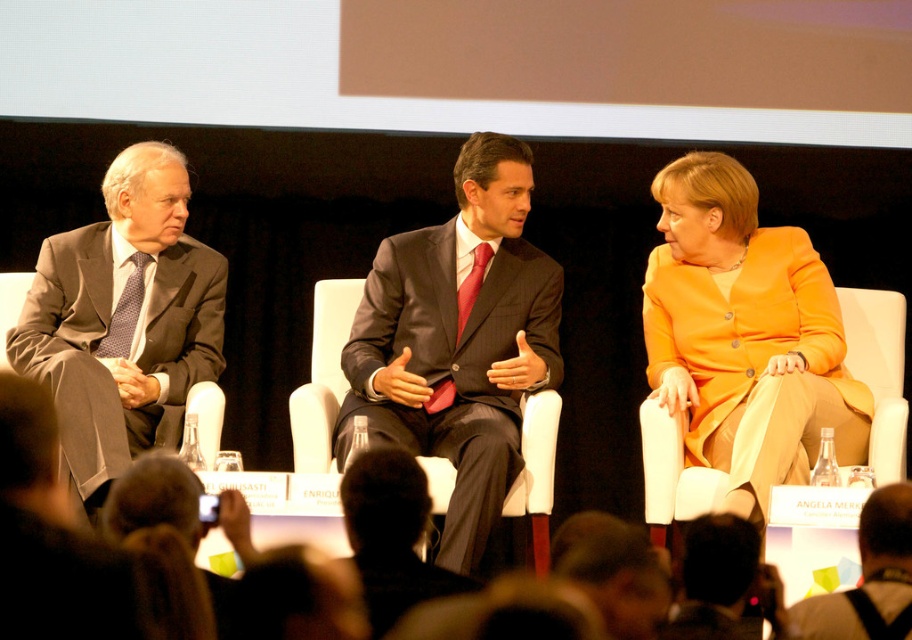
Can you confirm if matte black suit at center is wider than black fabric head at lower center?

Yes, matte black suit at center is wider than black fabric head at lower center.

Is matte black suit at center above black fabric head at lower center?

Yes.

The image size is (912, 640). I want to click on matte black suit at center, so click(458, 342).

Locate an element on the screen. matte black suit at center is located at coordinates (458, 342).

Which of these two, black fabric head at lower center or blue dotted tie at left, stands taller?

blue dotted tie at left

You are a GUI agent. You are given a task and a screenshot of the screen. Output one action in this format:
    pyautogui.click(x=<x>, y=<y>)
    Task: Click on the black fabric head at lower center
    This screenshot has height=640, width=912.
    Given the screenshot: What is the action you would take?
    pyautogui.click(x=721, y=579)

Where is `black fabric head at lower center`? black fabric head at lower center is located at coordinates (721, 579).

Who is positioned more to the left, blue dotted tie at left or red silk tie at center?

From the viewer's perspective, blue dotted tie at left appears more on the left side.

Identify the location of blue dotted tie at left. (125, 310).

I want to click on blue dotted tie at left, so click(x=125, y=310).